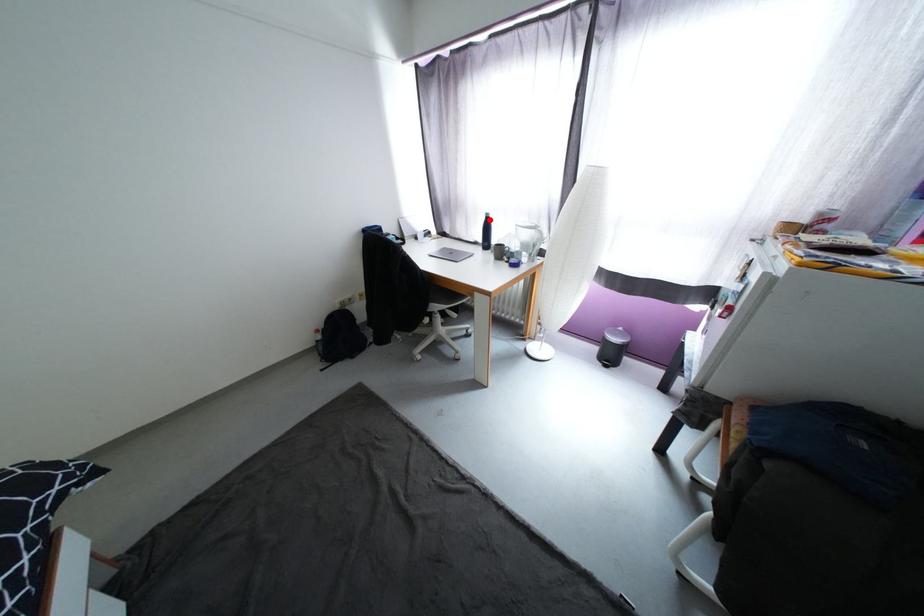
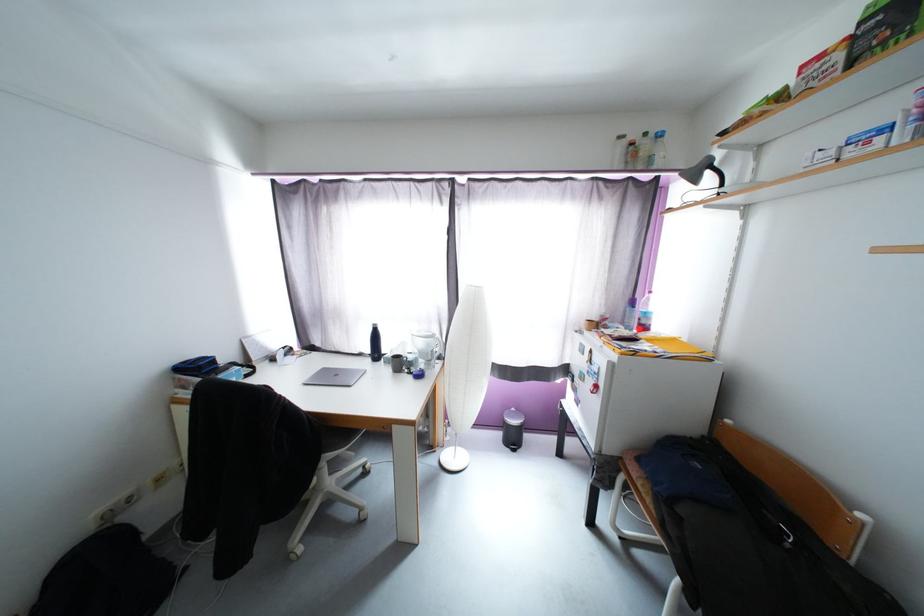
Locate, in the second image, the point that corresponds to the highlighted location in the first image.

(377, 331)